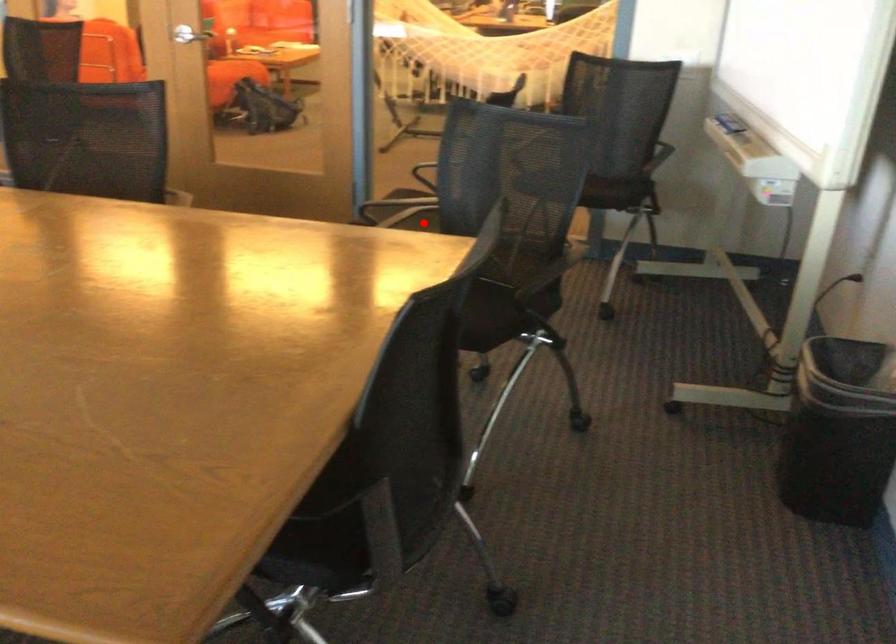
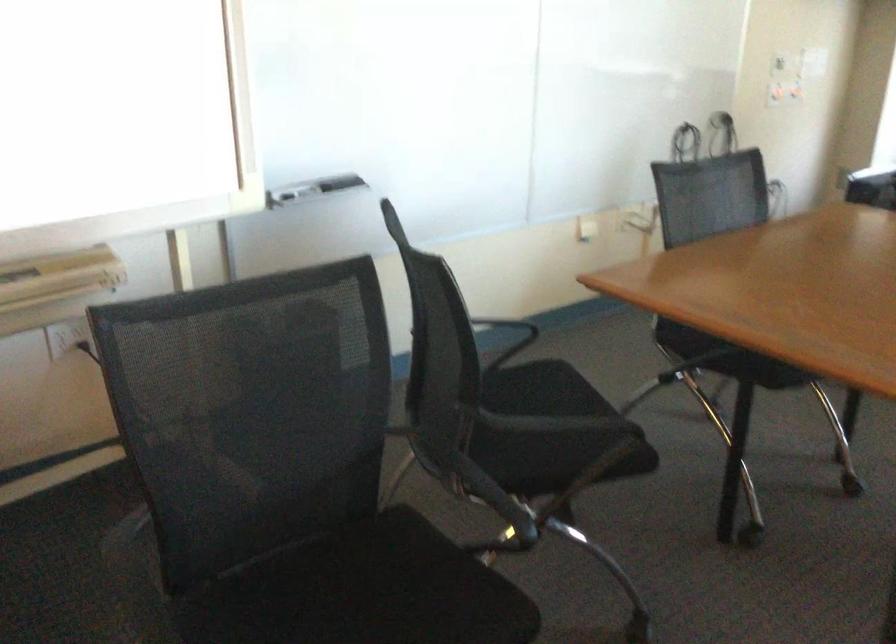
Question: I am providing you with two images of the same scene from different viewpoints. Image1 has a red point marked. In image2, the corresponding 3D location appears at what relative position? Reply with the corresponding letter.

Choices:
 (A) Closer
 (B) Farther

Answer: (A)